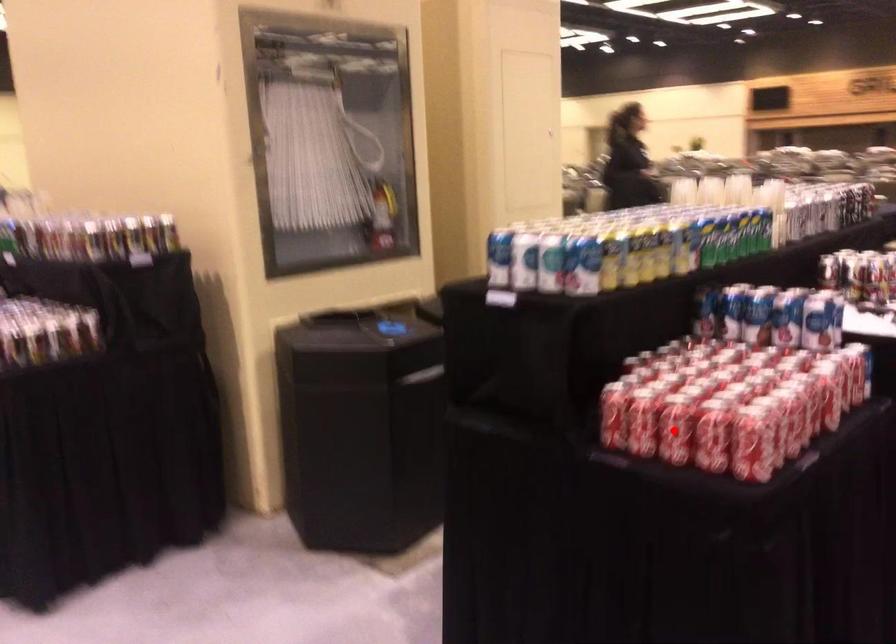
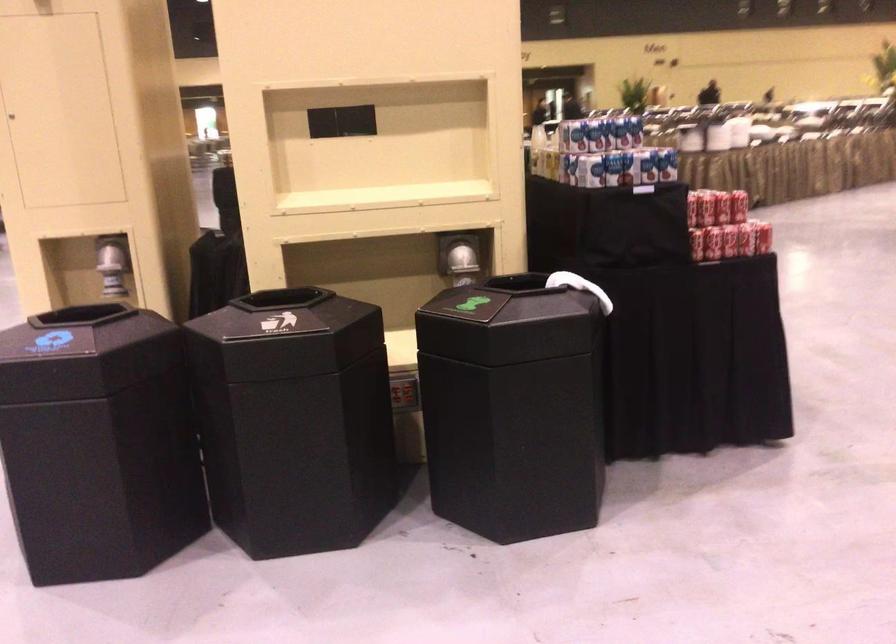
Question: I am providing you with two images of the same scene from different viewpoints. A red point is marked on the first image. At the location where the point appears in image 1, is it still visible in image 2?

Choices:
 (A) Yes
 (B) No

Answer: (B)